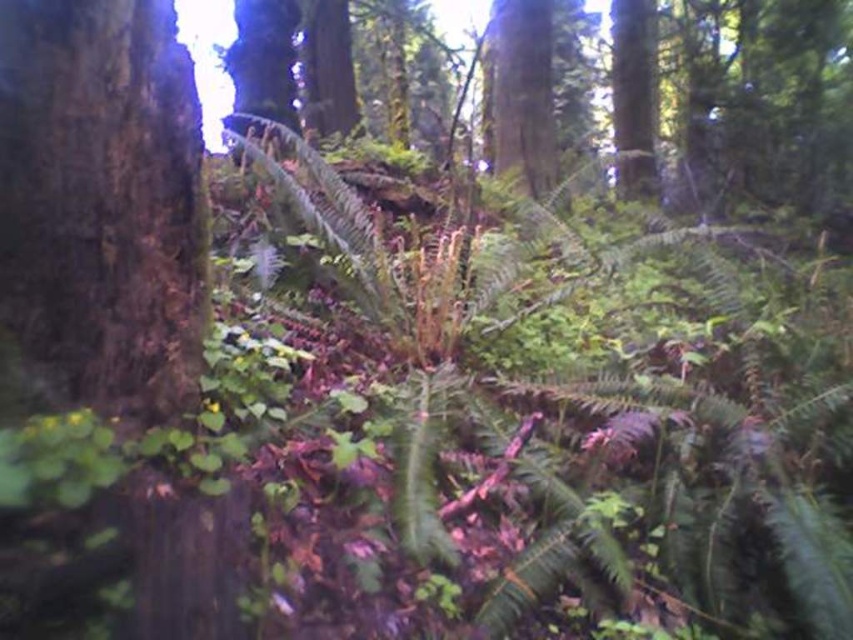
Can you confirm if dark brown rough bark at left is thinner than green rough bark tree at upper right?

Yes.

Is point (186, 392) behind point (619, 24)?

No.

This screenshot has height=640, width=853. What are the coordinates of `dark brown rough bark at left` in the screenshot? It's located at (99, 208).

The height and width of the screenshot is (640, 853). Identify the location of dark brown rough bark at left. (99, 208).

Between point (80, 51) and point (521, 52), which one is positioned behind?

The point (521, 52) is more distant.

You are a GUI agent. You are given a task and a screenshot of the screen. Output one action in this format:
    pyautogui.click(x=<x>, y=<y>)
    Task: Click on the dark brown rough bark at left
    
    Given the screenshot: What is the action you would take?
    pyautogui.click(x=99, y=208)

Who is more distant from viewer, (514,112) or (622,195)?

Positioned behind is point (622,195).

Who is positioned more to the left, smooth bark tree trunk at upper center or green rough bark tree at upper right?

From the viewer's perspective, smooth bark tree trunk at upper center appears more on the left side.

Is point (538, 52) farther from camera compared to point (640, 125)?

No, it is in front of (640, 125).

Locate an element on the screen. smooth bark tree trunk at upper center is located at coordinates 523,92.